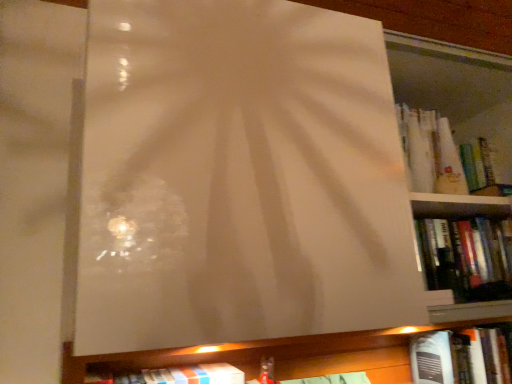
Question: Would you say hardcover book at upper right, which appears as the second book when viewed from the top, contains hardcover book at upper right, which ranks as the second book in right-to-left order?

Choices:
 (A) yes
 (B) no

Answer: (B)

Question: From a real-world perspective, is hardcover book at upper right, which appears as the second book when viewed from the top, positioned over hardcover book at upper right, which ranks as the second book in right-to-left order, based on gravity?

Choices:
 (A) no
 (B) yes

Answer: (A)

Question: From a real-world perspective, is hardcover book at upper right, the 3th book viewed from the right, located beneath hardcover book at upper right, which ranks as the second book in right-to-left order?

Choices:
 (A) no
 (B) yes

Answer: (B)

Question: Is hardcover book at upper right, the 3th book viewed from the right, wider than hardcover book at upper right, which ranks as the second book in right-to-left order?

Choices:
 (A) yes
 (B) no

Answer: (A)

Question: From the image's perspective, is hardcover book at upper right, which appears as the second book when viewed from the top, above hardcover book at upper right, acting as the 3th book starting from the left?

Choices:
 (A) yes
 (B) no

Answer: (B)

Question: From their relative heights in the image, would you say hardcover book at upper right, acting as the 4th book starting from the bottom, is taller or shorter than hardcover book at upper right, the 3th book viewed from the right?

Choices:
 (A) short
 (B) tall

Answer: (B)

Question: In terms of size, does hardcover book at upper right, acting as the 4th book starting from the bottom, appear bigger or smaller than hardcover book at upper right, which appears as the second book when viewed from the top?

Choices:
 (A) big
 (B) small

Answer: (B)

Question: Is hardcover book at upper right, acting as the 3th book starting from the left, in front of or behind hardcover book at upper right, the 3th book viewed from the right, in the image?

Choices:
 (A) front
 (B) behind

Answer: (B)

Question: Based on their positions, is hardcover book at upper right, acting as the 4th book starting from the bottom, located to the left or right of hardcover book at upper right, the 2th book in the left-to-right sequence?

Choices:
 (A) right
 (B) left

Answer: (A)

Question: From a real-world perspective, is hardcover book at lower right, which is the fourth book in left-to-right order, positioned above or below white matte book at lower center, the 3th book from the top?

Choices:
 (A) below
 (B) above

Answer: (A)

Question: Considering the positions of point [464, 359] and point [153, 382], is point [464, 359] closer or farther from the camera than point [153, 382]?

Choices:
 (A) farther
 (B) closer

Answer: (A)

Question: Is hardcover book at lower right, acting as the 1th book starting from the right, wider or thinner than white matte book at lower center, the 2th book positioned from the bottom?

Choices:
 (A) wide
 (B) thin

Answer: (B)

Question: Is hardcover book at lower right, acting as the fourth book starting from the top, to the left or to the right of white matte book at lower center, placed as the 4th book when sorted from right to left, in the image?

Choices:
 (A) left
 (B) right

Answer: (B)

Question: Visually, is hardcover book at upper right, the 3th book viewed from the right, positioned to the left or to the right of hardcover book at lower right, which ranks as the first book in bottom-to-top order?

Choices:
 (A) left
 (B) right

Answer: (A)

Question: Looking at the image, does hardcover book at upper right, which appears as the second book when viewed from the top, seem bigger or smaller compared to hardcover book at lower right, which is the fourth book in left-to-right order?

Choices:
 (A) big
 (B) small

Answer: (B)